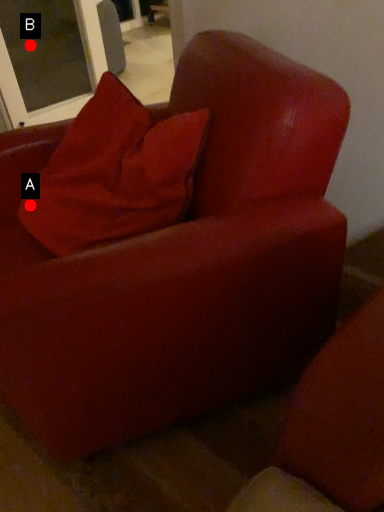
Question: Two points are circled on the image, labeled by A and B beside each circle. Which point is further to the camera?

Choices:
 (A) A is further
 (B) B is further

Answer: (B)